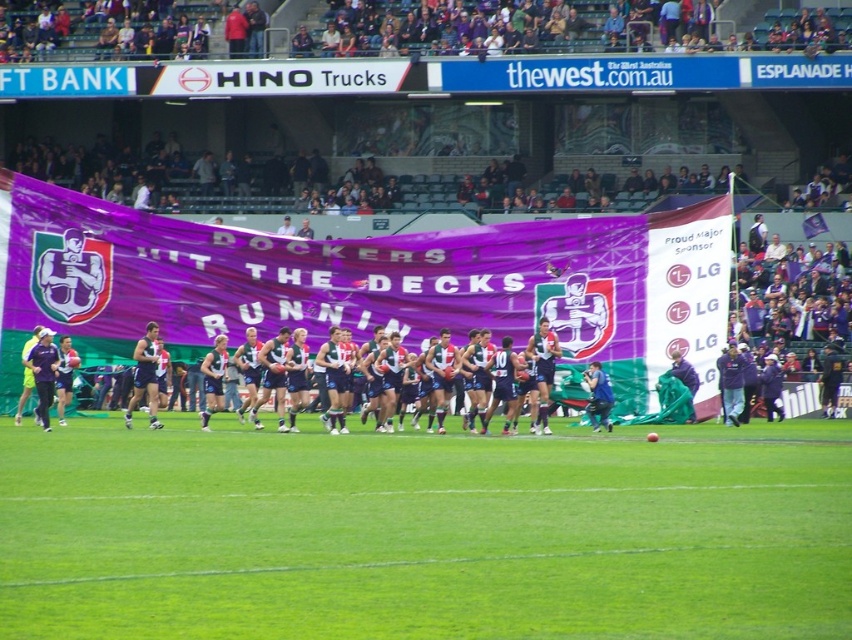
Question: Is green grass at center thinner than dark blue jersey at center?

Choices:
 (A) yes
 (B) no

Answer: (B)

Question: Does green grass at center appear on the left side of dark blue jersey at center?

Choices:
 (A) yes
 (B) no

Answer: (B)

Question: Is green grass at center positioned in front of dark blue jersey at center?

Choices:
 (A) no
 (B) yes

Answer: (B)

Question: Which point is closer to the camera?

Choices:
 (A) (312, 348)
 (B) (232, 588)

Answer: (B)

Question: Which point appears closest to the camera in this image?

Choices:
 (A) (117, 570)
 (B) (79, 385)

Answer: (A)

Question: Which point appears closest to the camera in this image?

Choices:
 (A) (127, 344)
 (B) (266, 524)

Answer: (B)